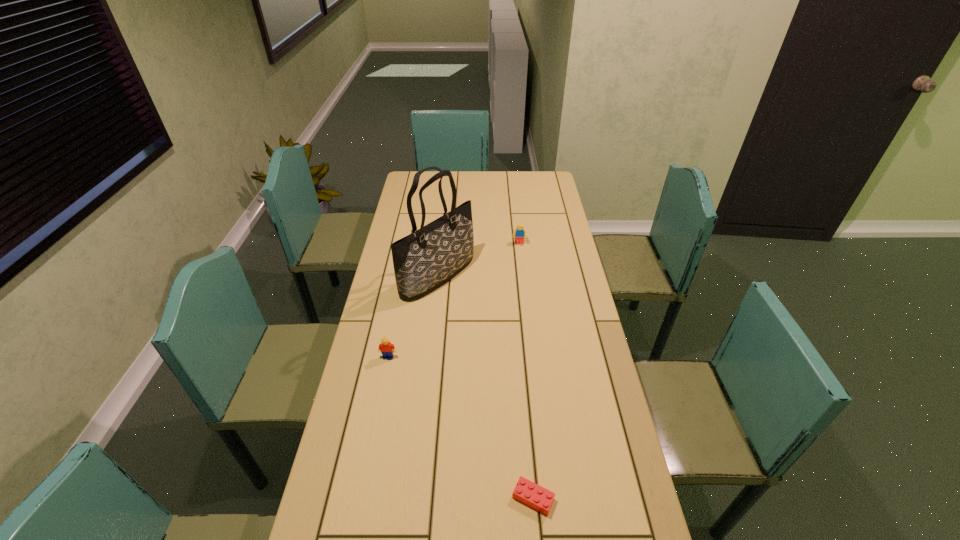
Choose which Lego is the nearest neighbor to the shortest Lego. Please provide its 2D coordinates. Your answer should be formatted as a tuple, i.e. [(x, y)], where the tuple contains the x and y coordinates of a point satisfying the conditions above.

[(387, 349)]

At what (x,y) coordinates should I click in order to perform the action: click on vacant space that satisfies the following two spatial constraints: 1. on the face of the leftmost Lego; 2. on the right side of the nearest object. Please return your answer as a coordinate pair (x, y). The height and width of the screenshot is (540, 960). Looking at the image, I should click on (360, 498).

Find the location of a particular element. Image resolution: width=960 pixels, height=540 pixels. vacant area in the image that satisfies the following two spatial constraints: 1. on the face of the nearest object; 2. on the right side of the second farthest Lego is located at coordinates (360, 498).

Where is `vacant space that satisfies the following two spatial constraints: 1. on the face of the second farthest Lego; 2. on the left side of the shortest Lego`? The width and height of the screenshot is (960, 540). vacant space that satisfies the following two spatial constraints: 1. on the face of the second farthest Lego; 2. on the left side of the shortest Lego is located at coordinates (360, 498).